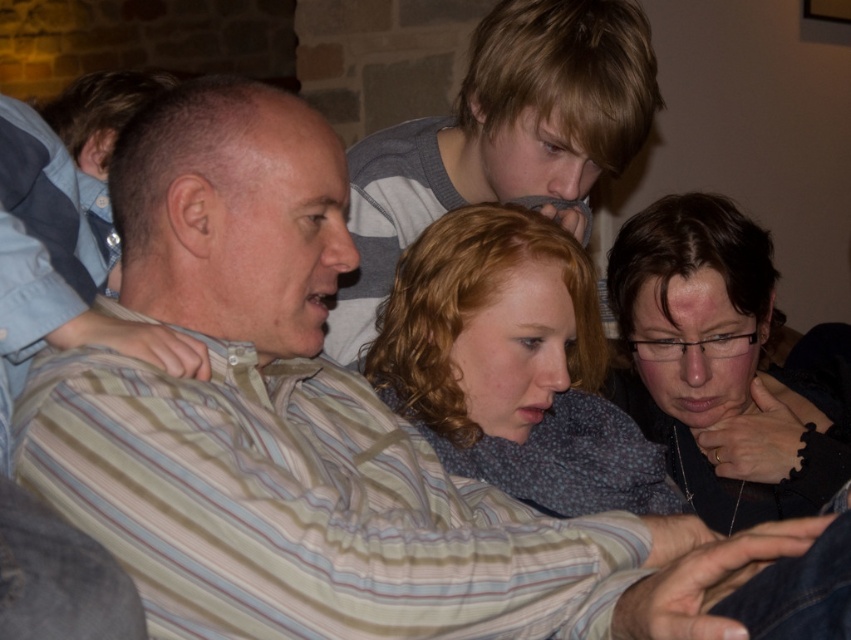
Image resolution: width=851 pixels, height=640 pixels. Describe the element at coordinates (512, 365) in the screenshot. I see `fluffy gray sweater at center` at that location.

Can you confirm if fluffy gray sweater at center is wider than matte black glasses at lower right?

Indeed, fluffy gray sweater at center has a greater width compared to matte black glasses at lower right.

Find the location of a particular element. The height and width of the screenshot is (640, 851). fluffy gray sweater at center is located at coordinates (512, 365).